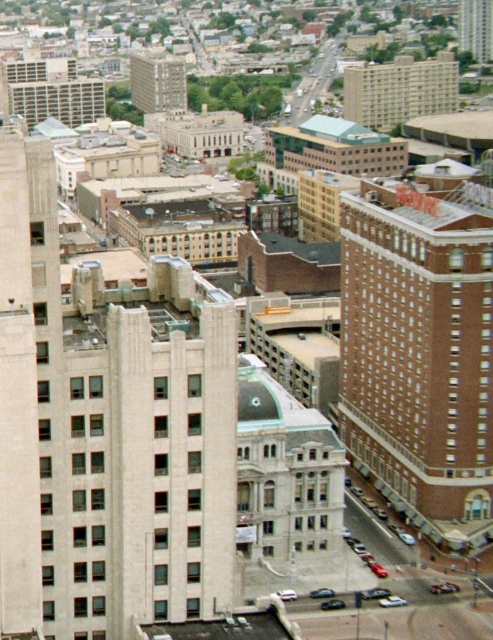
Does beige brick building at upper center come behind smooth glass skyscraper at upper right?

No, it is not.

Does beige brick building at upper center lie in front of smooth glass skyscraper at upper right?

Yes.

This screenshot has width=493, height=640. What do you see at coordinates (399, 90) in the screenshot? I see `beige brick building at upper center` at bounding box center [399, 90].

I want to click on beige brick building at upper center, so click(x=399, y=90).

Is brown brick building at right below beige brick building at center?

Indeed, brown brick building at right is positioned under beige brick building at center.

Does point (398, 458) come in front of point (177, 108)?

Yes, it is.

Image resolution: width=493 pixels, height=640 pixels. Identify the location of brown brick building at right. (421, 352).

Who is shorter, beige brick building at center or smooth glass skyscraper at upper right?

Standing shorter between the two is smooth glass skyscraper at upper right.

Does point (171, 80) lie behind point (466, 1)?

No, it is not.

Who is more distant from viewer, (180, 88) or (462, 49)?

The point (462, 49) is more distant.

At what (x,y) coordinates should I click in order to perform the action: click on beige brick building at center. Please return your answer as a coordinate pair (x, y). The image size is (493, 640). Looking at the image, I should click on (156, 81).